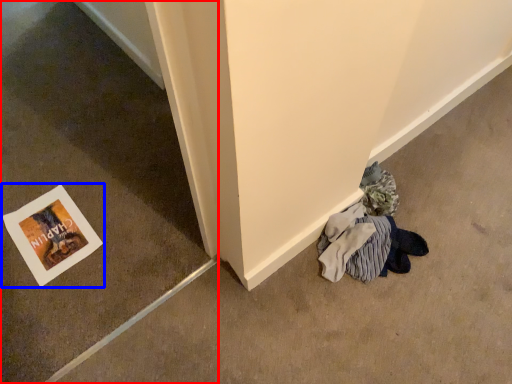
Question: Among these objects, which one is nearest to the camera, concrete (highlighted by a red box) or picture frame (highlighted by a blue box)?

Choices:
 (A) concrete
 (B) picture frame

Answer: (A)